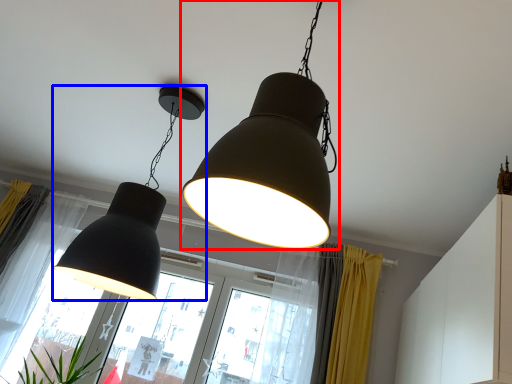
Question: Which object is closer to the camera taking this photo, lamp (highlighted by a red box) or lamp (highlighted by a blue box)?

Choices:
 (A) lamp
 (B) lamp

Answer: (A)